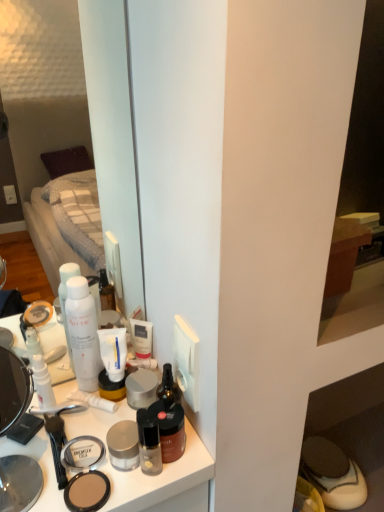
The width and height of the screenshot is (384, 512). In order to click on free space above matte plastic makeup at center (from a real-world perspective) in this screenshot , I will do `click(82, 440)`.